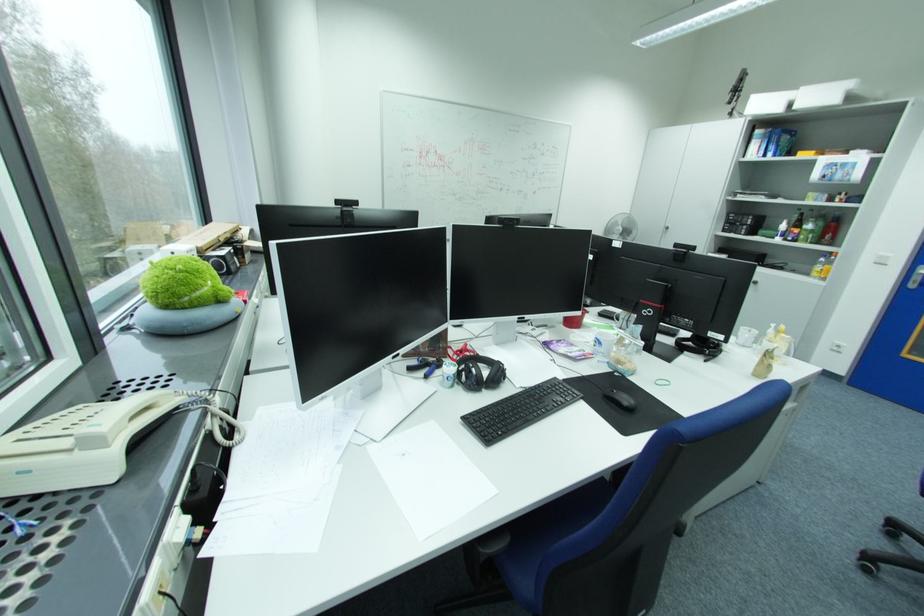
Which object does [518,410] point to?

It refers to a black keyboard.